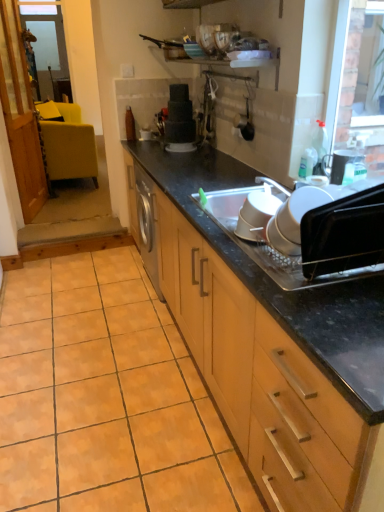
At what (x,y) coordinates should I click in order to perform the action: click on free space in front of black plastic oven at right, acting as the 2th appliance starting from the right. Please return your answer as a coordinate pair (x, y). Image resolution: width=384 pixels, height=512 pixels. Looking at the image, I should click on (349, 309).